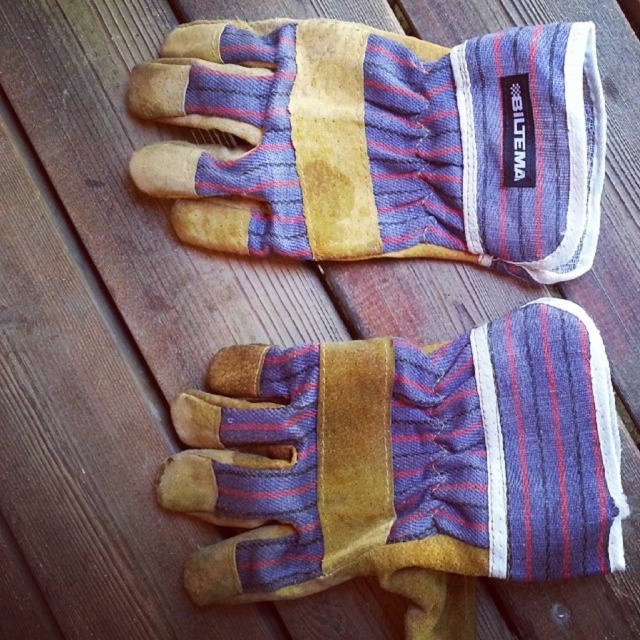
You are standing in front of the wooden surface where the gloves are placed. There is a point marked at coordinates point (404, 465). Which object is located at this point?

The worn leather glove at center is located at point (404, 465).

You are organizing a tool shed and see the worn leather glove at center and the leather gloves at center. Which object is located below the other?

The worn leather glove at center is positioned under the leather gloves at center, so the worn leather glove at center is below the leather gloves at center.

You are standing in front of the gloves and want to reach out to touch the point at coordinates point (204, 406). If your hand can extend 1.2 meters, will you be able to reach it?

The point (204, 406) is 1.32 meters away from the viewer. Since your hand can only extend 1.2 meters, you will not be able to reach it.